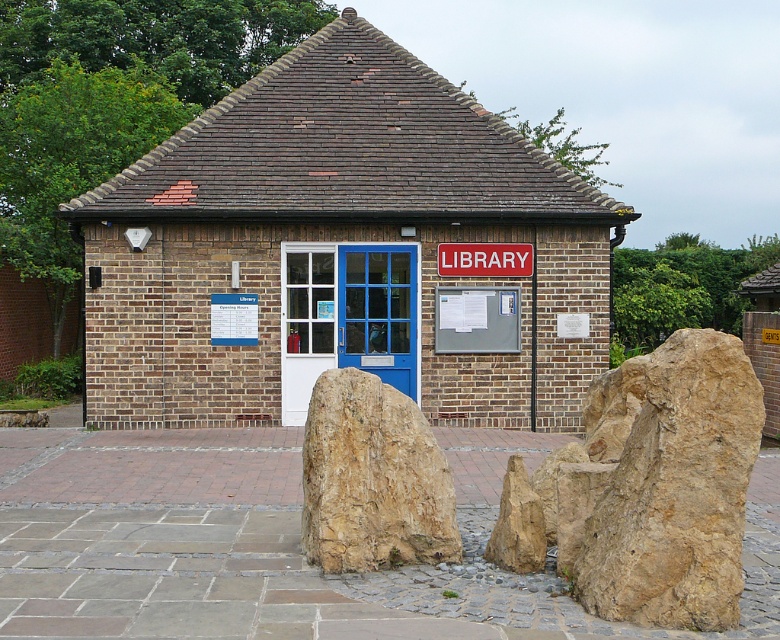
You are standing in front of the library building and want to touch both the point at coordinate point (702, 541) and point at coordinate point (445, 260). Which point should you reach for first?

You should reach for point (702, 541) first because it is closer to you than point (445, 260).

You are standing in front of the library building and see the brown rough rock at center and the red plastic sign at center. Which object is located to the left of the other?

The brown rough rock at center is positioned on the left side of red plastic sign at center.

You are standing in front of the library and see the brown rough rock at lower right and the red plastic sign at center. Which object is positioned lower on the image?

The brown rough rock at lower right is positioned lower than the red plastic sign at center.